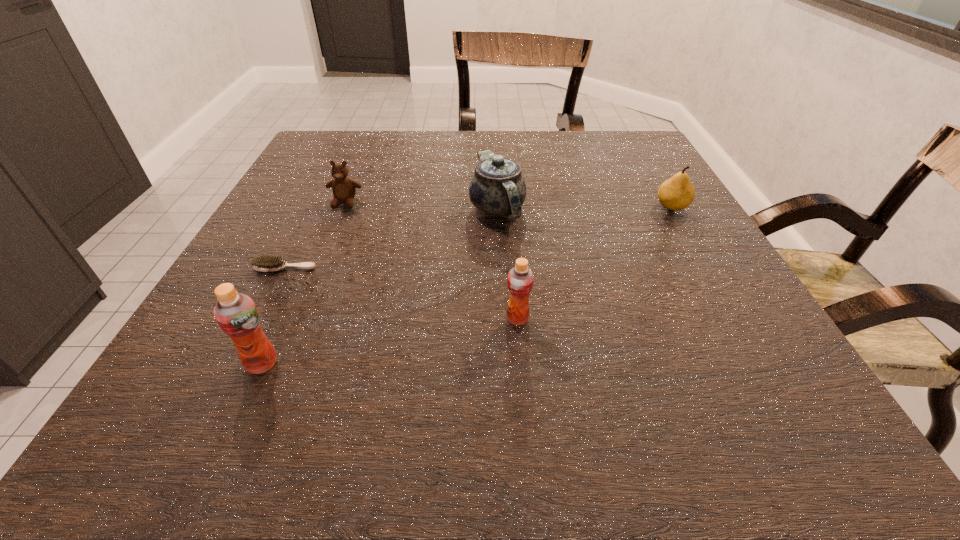
What are the coordinates of `object that is at the near left corner` in the screenshot? It's located at (236, 314).

Locate an element on the screen. Image resolution: width=960 pixels, height=540 pixels. vacant region at the far edge is located at coordinates (532, 157).

The height and width of the screenshot is (540, 960). Identify the location of blank area at the left edge. (339, 212).

In the image, there is a desktop. Where is `vacant space at the right edge`? The height and width of the screenshot is (540, 960). vacant space at the right edge is located at coordinates (745, 294).

You are a GUI agent. You are given a task and a screenshot of the screen. Output one action in this format:
    pyautogui.click(x=<x>, y=<y>)
    Task: Click on the vacant space at the far left corner of the desktop
    
    Given the screenshot: What is the action you would take?
    pyautogui.click(x=320, y=152)

In order to click on free spot at the far right corner of the desktop in this screenshot , I will do `click(584, 135)`.

Identify the location of free space at the near right corner of the desktop. (673, 340).

The width and height of the screenshot is (960, 540). Find the location of `vacant area that lies between the taller orange juice and the chinaware`. vacant area that lies between the taller orange juice and the chinaware is located at coordinates (379, 286).

This screenshot has width=960, height=540. In order to click on free space between the shortest object and the chinaware in this screenshot , I will do `click(391, 238)`.

I want to click on vacant space in between the tallest object and the teddy bear, so click(x=303, y=283).